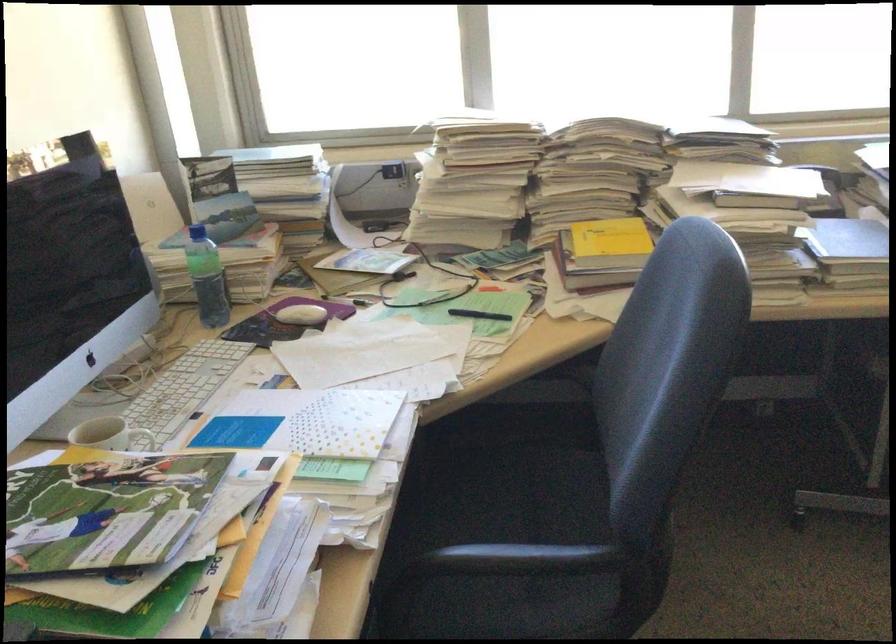
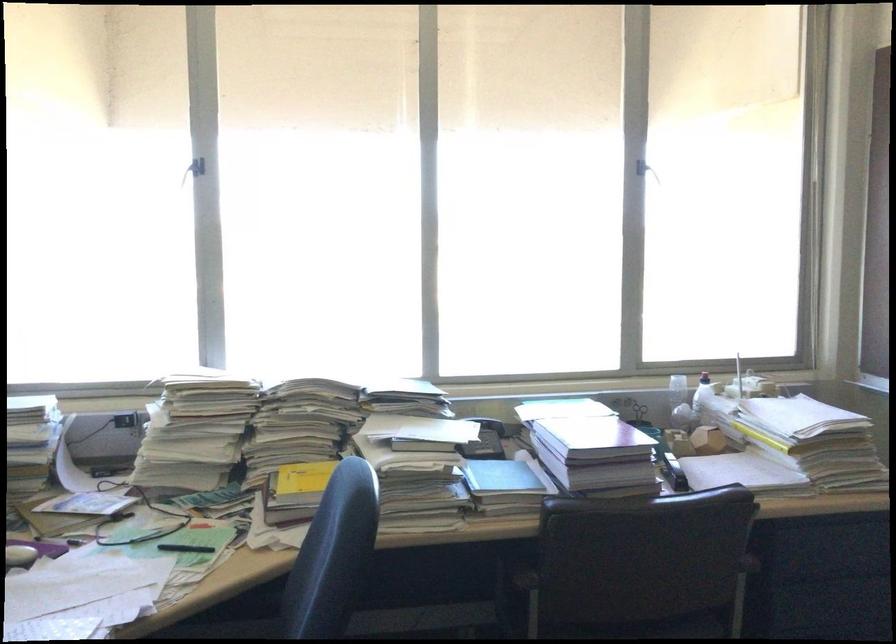
The point at (x=815, y=196) is marked in the first image. Where is the corresponding point in the second image?

(485, 440)